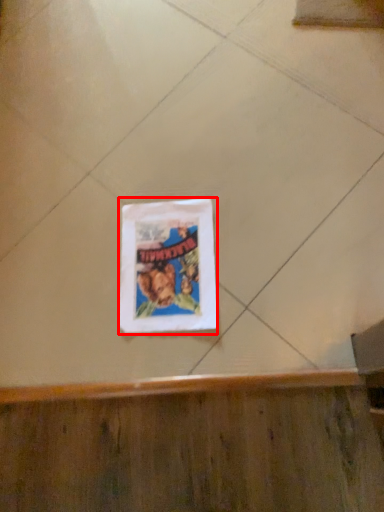
Question: From the image, what is the correct spatial relationship of picture frame (annotated by the red box) in relation to ceramic tile?

Choices:
 (A) right
 (B) left

Answer: (B)